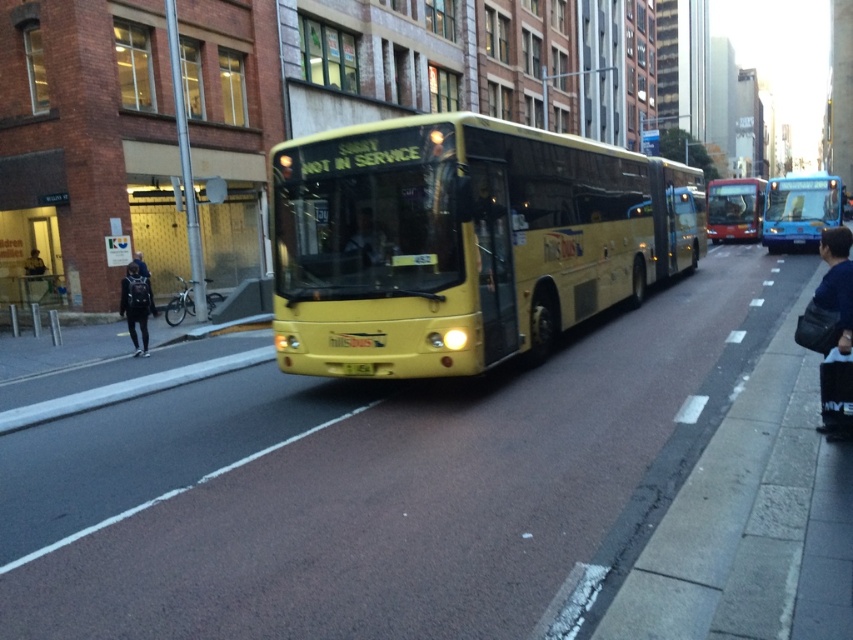
Between point (799, 179) and point (840, 337), which one is positioned in front?

Point (840, 337) is in front.

The width and height of the screenshot is (853, 640). I want to click on blue glossy bus at center, so click(799, 209).

Is metallic red bus at center wider than dark blue fabric jacket at left?

Indeed, metallic red bus at center has a greater width compared to dark blue fabric jacket at left.

Which is in front, point (737, 202) or point (137, 284)?

Positioned in front is point (137, 284).

Is point (744, 228) positioned before point (138, 304)?

That is False.

This screenshot has height=640, width=853. What are the coordinates of `metallic red bus at center` in the screenshot? It's located at (734, 209).

Is point (851, 332) positioned in front of point (376, 241)?

That is True.

In the scene shown: Is denim jacket at lower right closer to camera compared to matte black bus at center?

Yes.

Who is more distant from viewer, (846,241) or (368,221)?

The point (368,221) is behind.

Locate an element on the screen. This screenshot has height=640, width=853. denim jacket at lower right is located at coordinates (837, 280).